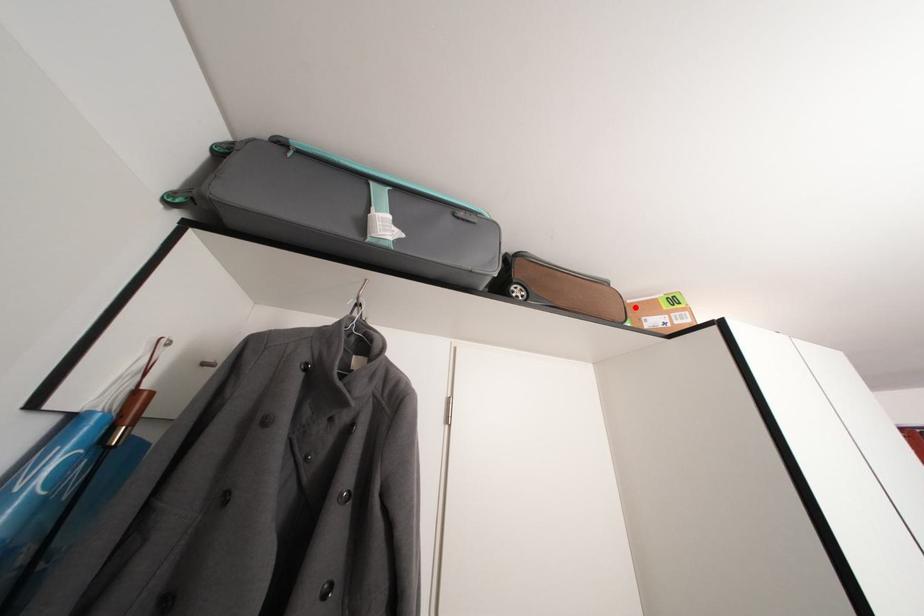
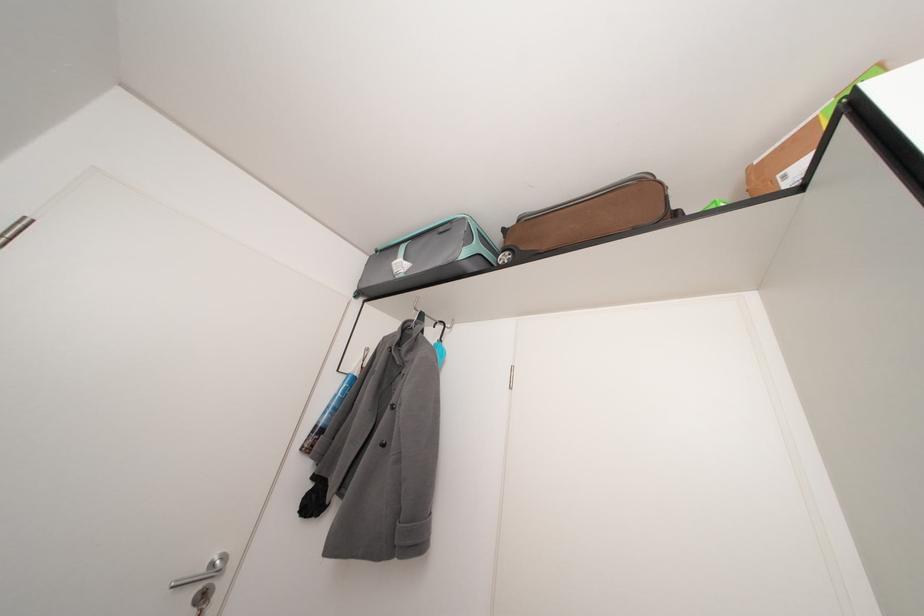
Locate, in the second image, the point that corresponds to the highlighted location in the first image.

(763, 168)